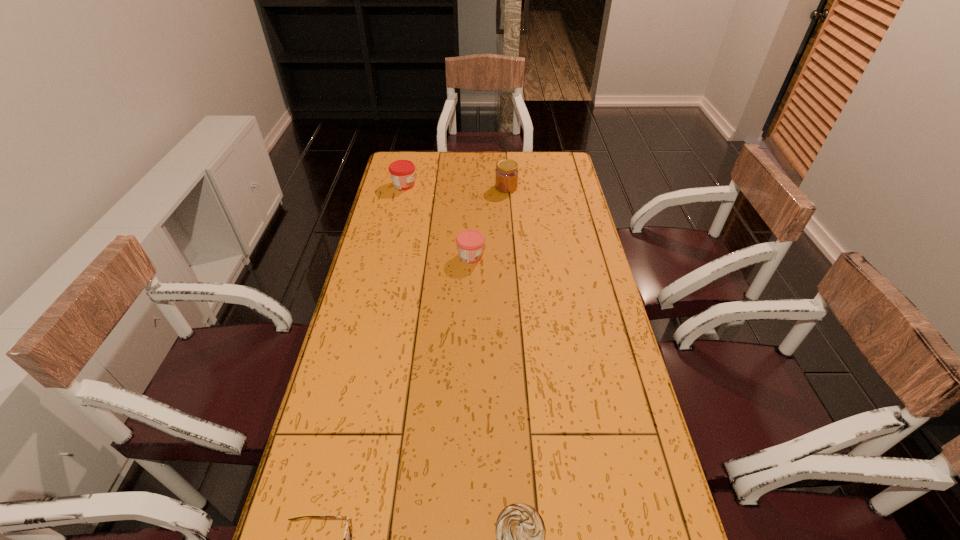
Locate an element on the screen. the rightmost jam is located at coordinates (506, 173).

Where is `the tallest jam`? The image size is (960, 540). the tallest jam is located at coordinates coord(506,173).

At what (x,y) coordinates should I click in order to perform the action: click on the leftmost jam. Please return your answer as a coordinate pair (x, y). Looking at the image, I should click on (402, 172).

The width and height of the screenshot is (960, 540). In order to click on the second jam from right to left in this screenshot , I will do `click(470, 243)`.

The image size is (960, 540). I want to click on the nearest jam, so click(x=470, y=243).

Find the location of a particular element. This screenshot has width=960, height=540. blank area located on the front of the rightmost jam is located at coordinates (509, 217).

Find the location of `vacant area located 0.340m on the label side of the leftmost jam`. vacant area located 0.340m on the label side of the leftmost jam is located at coordinates (493, 185).

Where is `free space located on the front label of the nearest jam`? free space located on the front label of the nearest jam is located at coordinates (510, 256).

The height and width of the screenshot is (540, 960). I want to click on object that is at the far edge, so click(x=402, y=172).

Where is `object that is at the left edge`? object that is at the left edge is located at coordinates 402,172.